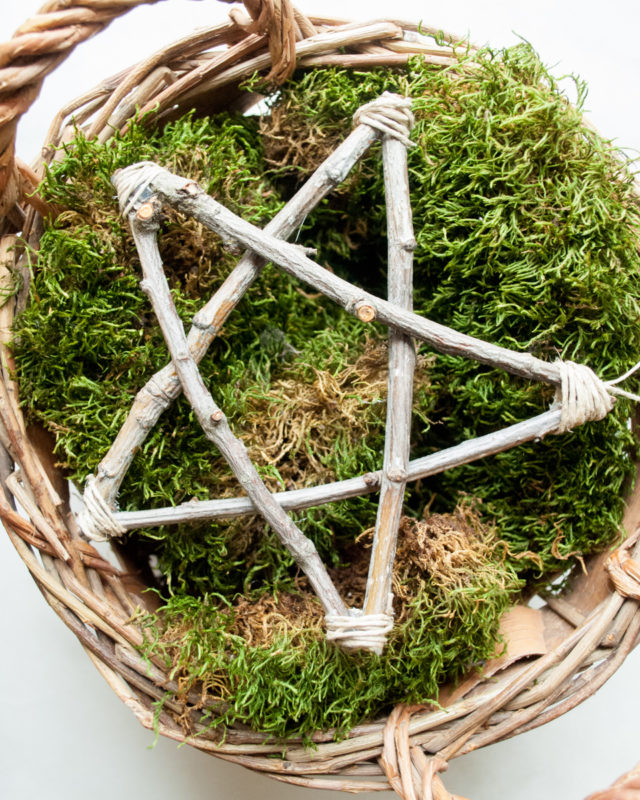
Image resolution: width=640 pixels, height=800 pixels. I want to click on white left bottom of basket, so click(x=61, y=730).